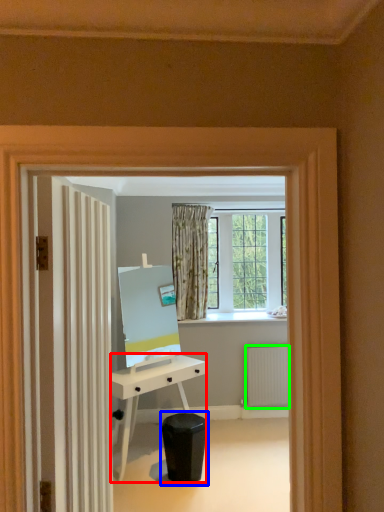
Question: Which is farther away from desk (highlighted by a red box)? swivel chair (highlighted by a blue box) or radiator (highlighted by a green box)?

Choices:
 (A) swivel chair
 (B) radiator

Answer: (B)